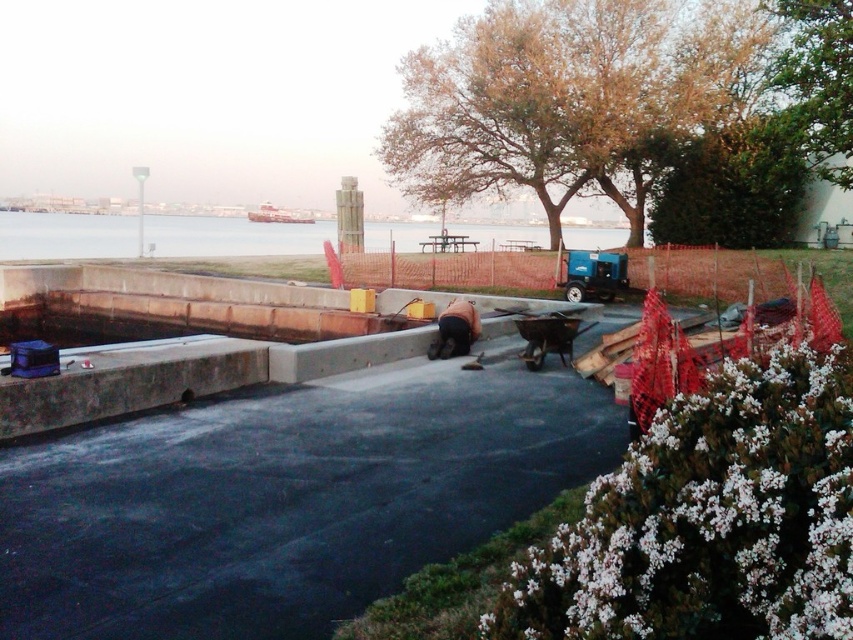
Question: Is green leafy tree at upper right bigger than dark brown leather jacket at center?

Choices:
 (A) no
 (B) yes

Answer: (A)

Question: Which is farther from the brown leafy tree at upper center?

Choices:
 (A) gray concrete at lower left
 (B) dark brown leather jacket at center
 (C) green leafy tree at upper right
 (D) black asphalt pavement at center

Answer: (D)

Question: Does brown leafy tree at upper center appear on the left side of clear water at center?

Choices:
 (A) no
 (B) yes

Answer: (A)

Question: Does clear water at center have a lesser width compared to green leafy tree at upper right?

Choices:
 (A) yes
 (B) no

Answer: (B)

Question: Which point is closer to the camera taking this photo?

Choices:
 (A) (837, 148)
 (B) (608, 28)
 (C) (402, 561)

Answer: (C)

Question: Which of the following is the farthest from the observer?

Choices:
 (A) green leafy tree at upper right
 (B) dark brown leather jacket at center

Answer: (A)